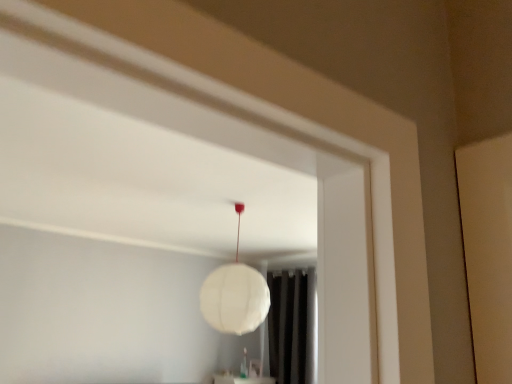
Question: Can you confirm if white paper lamp at center is bigger than black fabric curtain at lower center?

Choices:
 (A) no
 (B) yes

Answer: (A)

Question: From the image's perspective, is white paper lamp at center under black fabric curtain at lower center?

Choices:
 (A) yes
 (B) no

Answer: (B)

Question: Could you tell me if white paper lamp at center is facing black fabric curtain at lower center?

Choices:
 (A) no
 (B) yes

Answer: (A)

Question: From a real-world perspective, is white paper lamp at center positioned over black fabric curtain at lower center based on gravity?

Choices:
 (A) no
 (B) yes

Answer: (B)

Question: From the image's perspective, is white paper lamp at center above black fabric curtain at lower center?

Choices:
 (A) no
 (B) yes

Answer: (B)

Question: Is white paper lamp at center to the right of black fabric curtain at lower center from the viewer's perspective?

Choices:
 (A) no
 (B) yes

Answer: (A)

Question: Does black fabric curtain at lower center have a greater height compared to white paper lamp at center?

Choices:
 (A) no
 (B) yes

Answer: (B)

Question: Considering the relative sizes of black fabric curtain at lower center and white paper lamp at center in the image provided, is black fabric curtain at lower center thinner than white paper lamp at center?

Choices:
 (A) yes
 (B) no

Answer: (A)

Question: Would you say black fabric curtain at lower center is a long distance from white paper lamp at center?

Choices:
 (A) yes
 (B) no

Answer: (A)

Question: From the image's perspective, is black fabric curtain at lower center below white paper lamp at center?

Choices:
 (A) yes
 (B) no

Answer: (A)

Question: Is black fabric curtain at lower center facing away from white paper lamp at center?

Choices:
 (A) yes
 (B) no

Answer: (B)

Question: Is black fabric curtain at lower center in contact with white paper lamp at center?

Choices:
 (A) yes
 (B) no

Answer: (B)

Question: Relative to white paper lamp at center, is black fabric curtain at lower center in front or behind?

Choices:
 (A) front
 (B) behind

Answer: (B)